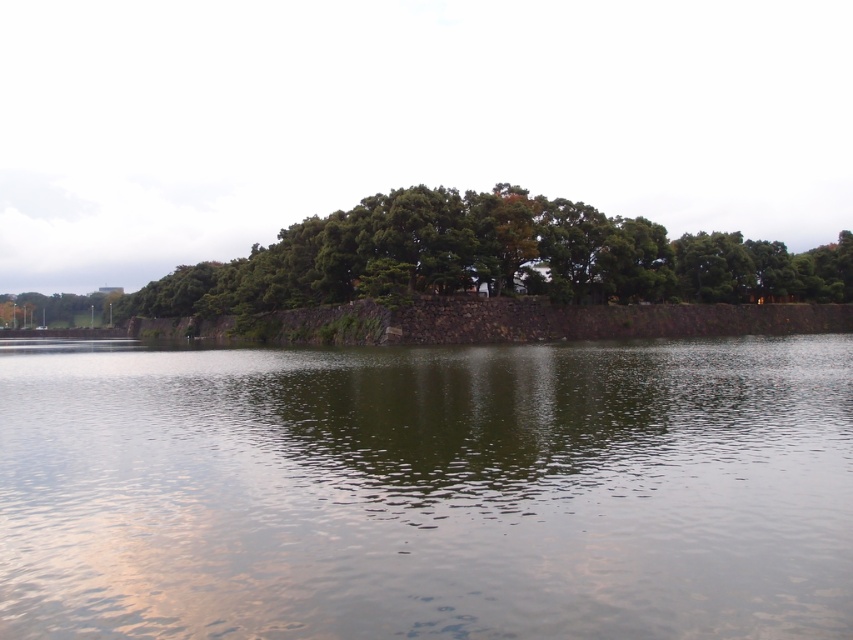
You are a bird flying over the scene and want to land on the tallest object between the green reflective water at center and the green leafy tree at center. Which object should you choose?

The green leafy tree at center is taller than the green reflective water at center, so you should land on the green leafy tree at center.

You are standing at the edge of the scene and want to reach the green reflective water at center. Based on the coordinates provided, in which direction should you move relative to your current position?

The green reflective water at center is located at coordinates point (x=427, y=490). Since the x and y values are both above 0.5, you should move towards the right and forward to reach it.